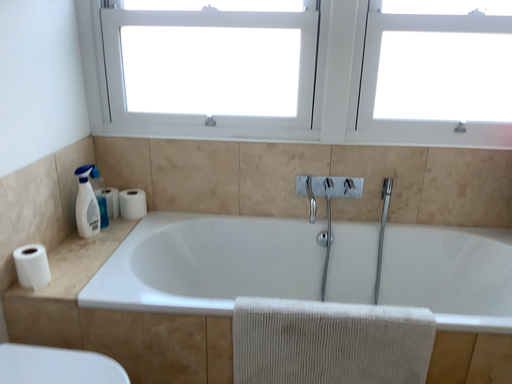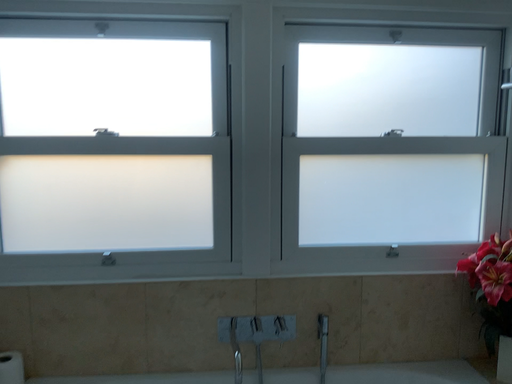
Question: How did the camera likely rotate when shooting the video?

Choices:
 (A) rotated left
 (B) rotated right

Answer: (B)